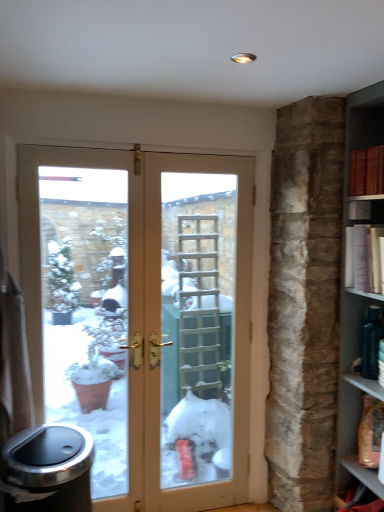
Question: Is white paper bookshelf at right, marked as the second book in a top-to-bottom arrangement, smaller than red leather book at upper right, positioned as the 2th book in bottom-to-top order?

Choices:
 (A) yes
 (B) no

Answer: (B)

Question: Is white paper bookshelf at right, which is the first book in bottom-to-top order, aimed at red leather book at upper right, positioned as the 2th book in bottom-to-top order?

Choices:
 (A) no
 (B) yes

Answer: (A)

Question: Is white paper bookshelf at right, which is the first book in bottom-to-top order, not inside red leather book at upper right, positioned as the 2th book in bottom-to-top order?

Choices:
 (A) yes
 (B) no

Answer: (A)

Question: Is the depth of white paper bookshelf at right, marked as the second book in a top-to-bottom arrangement, greater than that of red leather book at upper right, positioned as the 2th book in bottom-to-top order?

Choices:
 (A) no
 (B) yes

Answer: (A)

Question: Can you confirm if white paper bookshelf at right, marked as the second book in a top-to-bottom arrangement, is shorter than red leather book at upper right, the first book from the top?

Choices:
 (A) yes
 (B) no

Answer: (B)

Question: Does white paper bookshelf at right, marked as the second book in a top-to-bottom arrangement, touch red leather book at upper right, the first book from the top?

Choices:
 (A) no
 (B) yes

Answer: (A)

Question: From a real-world perspective, is white paper bookshelf at right, which is the first book in bottom-to-top order, positioned over matte brown wood at lower right based on gravity?

Choices:
 (A) yes
 (B) no

Answer: (A)

Question: Is white paper bookshelf at right, marked as the second book in a top-to-bottom arrangement, located outside matte brown wood at lower right?

Choices:
 (A) yes
 (B) no

Answer: (A)

Question: Considering the relative sizes of white paper bookshelf at right, marked as the second book in a top-to-bottom arrangement, and matte brown wood at lower right in the image provided, is white paper bookshelf at right, marked as the second book in a top-to-bottom arrangement, smaller than matte brown wood at lower right?

Choices:
 (A) no
 (B) yes

Answer: (A)

Question: Does white paper bookshelf at right, marked as the second book in a top-to-bottom arrangement, have a larger size compared to matte brown wood at lower right?

Choices:
 (A) no
 (B) yes

Answer: (B)

Question: Does white paper bookshelf at right, marked as the second book in a top-to-bottom arrangement, have a greater height compared to matte brown wood at lower right?

Choices:
 (A) no
 (B) yes

Answer: (B)

Question: Does white paper bookshelf at right, marked as the second book in a top-to-bottom arrangement, appear on the right side of matte brown wood at lower right?

Choices:
 (A) yes
 (B) no

Answer: (A)

Question: Is red leather book at upper right, the first book from the top, taller than shiny metallic trash can at lower left?

Choices:
 (A) yes
 (B) no

Answer: (B)